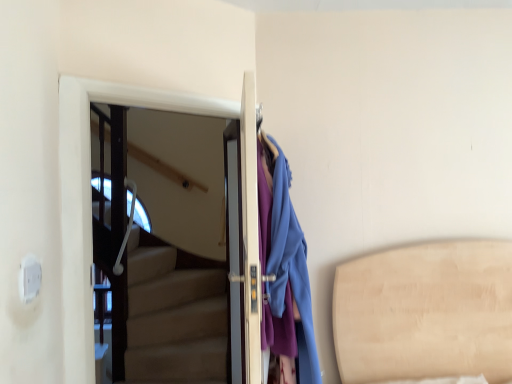
Question: Based on their sizes in the image, would you say white glossy door at upper left, placed as the first door when sorted from left to right, is bigger or smaller than matte blue coat at right?

Choices:
 (A) small
 (B) big

Answer: (A)

Question: Would you say white glossy door at upper left, placed as the first door when sorted from left to right, is to the left or to the right of matte blue coat at right in the picture?

Choices:
 (A) right
 (B) left

Answer: (B)

Question: Considering the real-world distances, which object is closest to the matte white door at center, which ranks as the 2th door in left-to-right order?

Choices:
 (A) matte blue coat at right
 (B) white glossy door at upper left, the 2th door from the right

Answer: (A)

Question: Which object is the closest to the matte white door at center, which ranks as the 2th door in left-to-right order?

Choices:
 (A) white glossy door at upper left, the 2th door from the right
 (B) matte blue coat at right

Answer: (B)